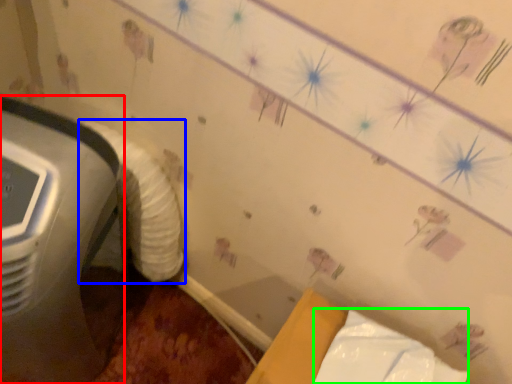
Question: Considering the real-world distances, which object is closest to home appliance (highlighted by a red box)? sheet (highlighted by a blue box) or wrapping paper (highlighted by a green box).

Choices:
 (A) sheet
 (B) wrapping paper

Answer: (A)